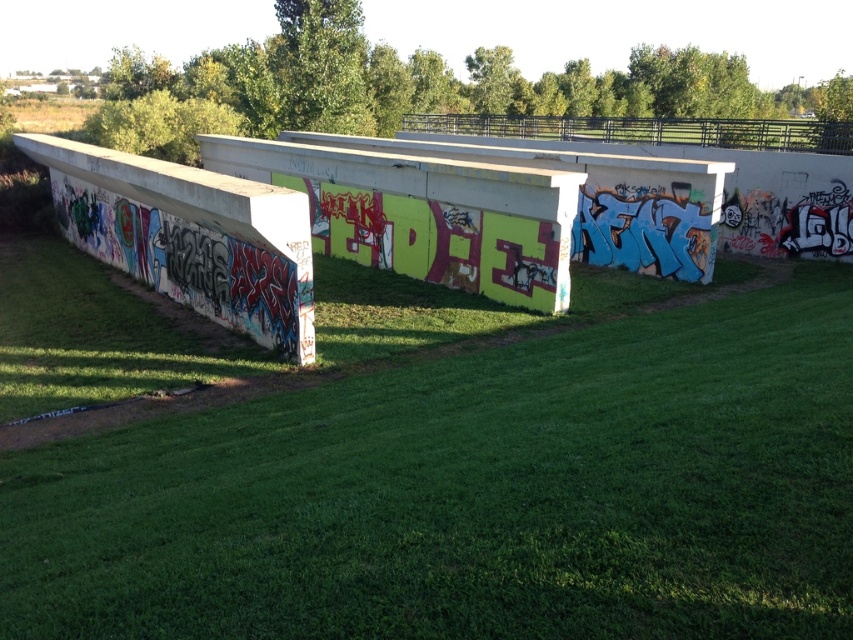
Locate an element on the screen. The image size is (853, 640). green grass at center is located at coordinates (434, 461).

Between green grass at center and concreteroughbridge at left, which one has more height?

Standing taller between the two is concreteroughbridge at left.

Is point (207, 426) positioned after point (154, 266)?

No, it is not.

In order to click on green grass at center in this screenshot , I will do `click(434, 461)`.